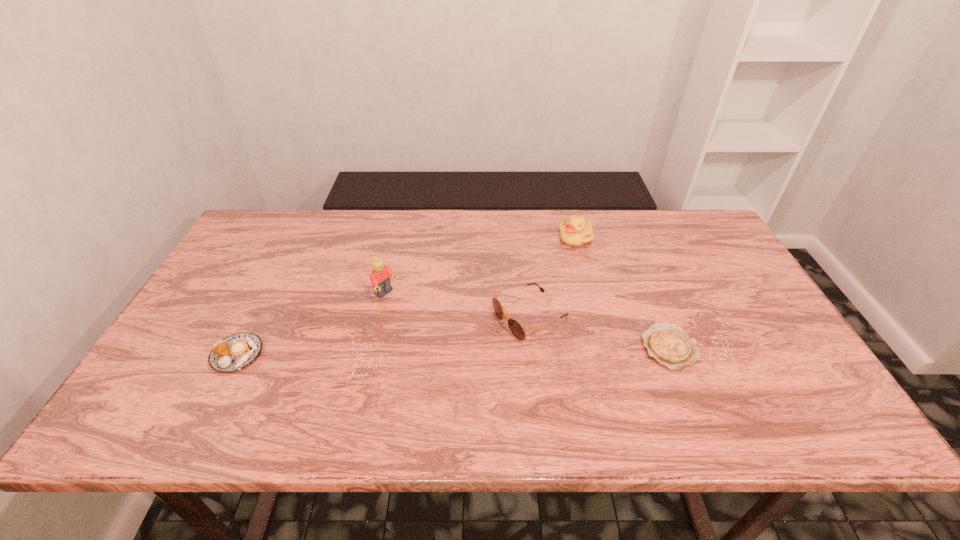
Find the location of a particular element. Image resolution: width=960 pixels, height=540 pixels. vacant space located on the face of the tallest object is located at coordinates (415, 314).

Where is `object at the far edge`? This screenshot has width=960, height=540. object at the far edge is located at coordinates (577, 231).

In order to click on pastry present at the near edge in this screenshot , I will do `click(237, 351)`.

This screenshot has height=540, width=960. Find the location of `quiche that is at the near edge`. quiche that is at the near edge is located at coordinates (668, 344).

Find the location of a particular element. The image size is (960, 540). object at the left edge is located at coordinates (237, 351).

Identify the location of object that is positioned at the near left corner. Image resolution: width=960 pixels, height=540 pixels. (237, 351).

This screenshot has height=540, width=960. In order to click on free space at the far edge in this screenshot , I will do `click(563, 213)`.

In the image, there is a desktop. Where is `free space at the near edge`? The height and width of the screenshot is (540, 960). free space at the near edge is located at coordinates (719, 367).

The width and height of the screenshot is (960, 540). What are the coordinates of `free location at the left edge` in the screenshot? It's located at (200, 337).

In the image, there is a desktop. Identify the location of free space at the right edge. (766, 310).